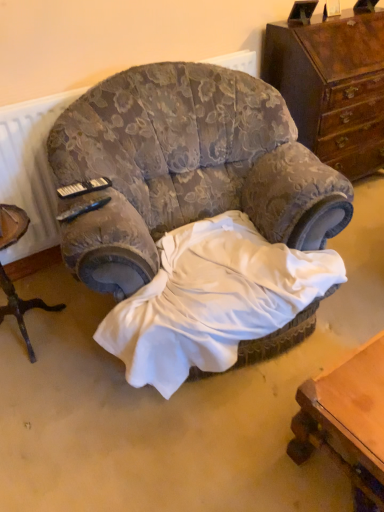
Question: Is white satin sheet at center to the left or to the right of wooden chest of drawers at upper right in the image?

Choices:
 (A) right
 (B) left

Answer: (B)

Question: In terms of height, does white satin sheet at center look taller or shorter compared to wooden chest of drawers at upper right?

Choices:
 (A) short
 (B) tall

Answer: (A)

Question: Which of these objects is positioned farthest from the white satin sheet at center?

Choices:
 (A) velvet floral armchair at center
 (B) wooden chest of drawers at upper right
 (C) wooden tripod table at left

Answer: (B)

Question: Which object is the farthest from the white satin sheet at center?

Choices:
 (A) velvet floral armchair at center
 (B) wooden tripod table at left
 (C) wooden chest of drawers at upper right

Answer: (C)